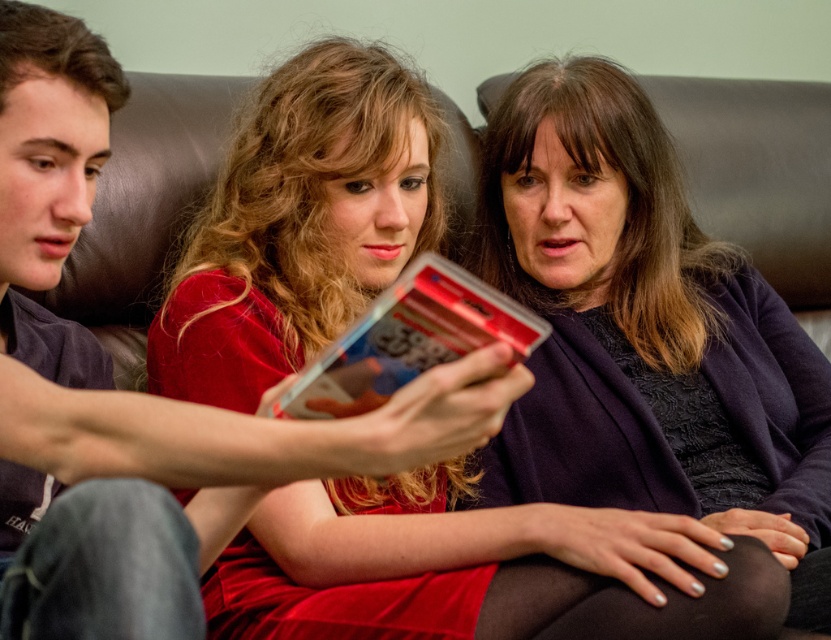
Question: Which object is closer to the camera taking this photo?

Choices:
 (A) matte black shirt at left
 (B) matte black sweater at center
 (C) velvet red dress at center
 (D) shiny plastic card at center

Answer: (A)

Question: Is matte black sweater at center closer to camera compared to matte black shirt at left?

Choices:
 (A) no
 (B) yes

Answer: (A)

Question: Which point is farther to the camera?

Choices:
 (A) matte black sweater at center
 (B) shiny plastic card at center

Answer: (A)

Question: Which object appears farthest from the camera in this image?

Choices:
 (A) matte black sweater at center
 (B) shiny plastic card at center
 (C) matte black shirt at left

Answer: (A)

Question: From the image, what is the correct spatial relationship of matte black sweater at center in relation to matte black shirt at left?

Choices:
 (A) above
 (B) below

Answer: (A)

Question: Is the position of velvet red dress at center less distant than that of matte black shirt at left?

Choices:
 (A) no
 (B) yes

Answer: (A)